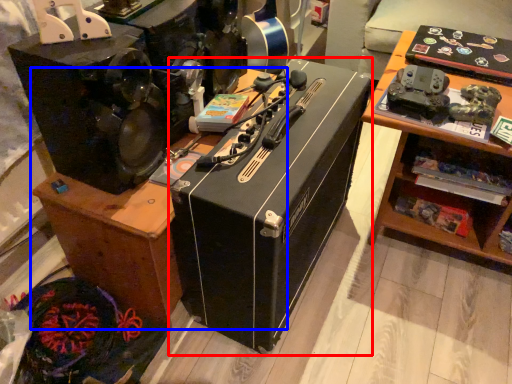
Question: Which of the following is the farthest to the observer, box (highlighted by a red box) or furniture (highlighted by a blue box)?

Choices:
 (A) box
 (B) furniture

Answer: (B)